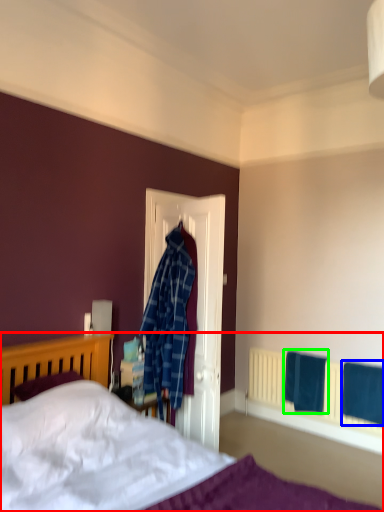
Question: Which object is the closest to the bed (highlighted by a red box)? Choose among these: bath towel (highlighted by a blue box) or bath towel (highlighted by a green box).

Choices:
 (A) bath towel
 (B) bath towel

Answer: (B)